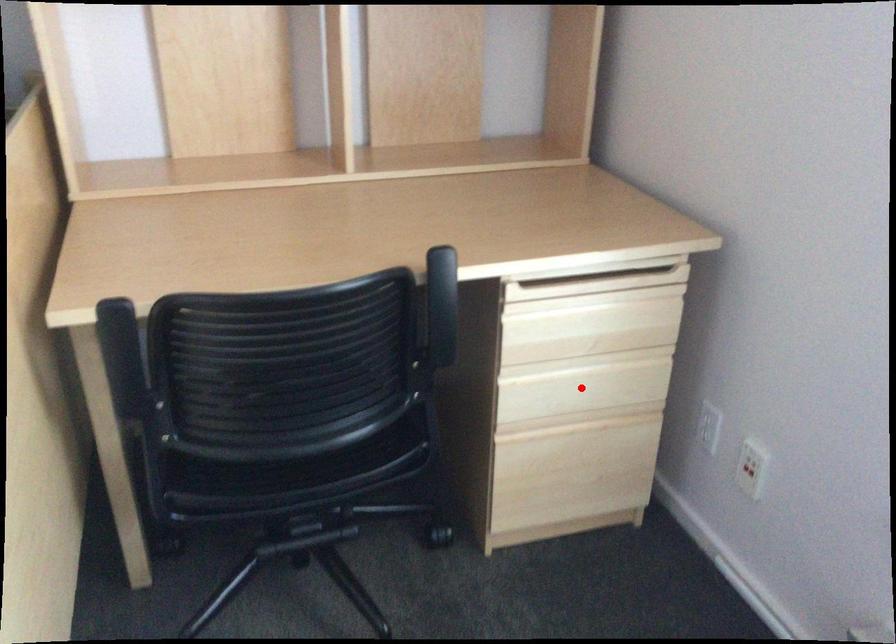
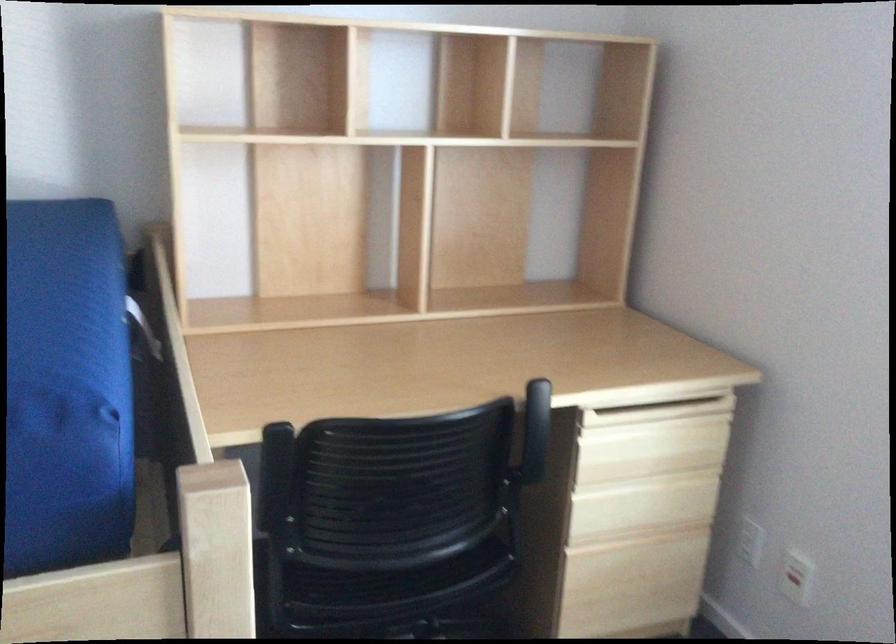
Find the pixel in the second image that matches the highlighted location in the first image.

(642, 506)